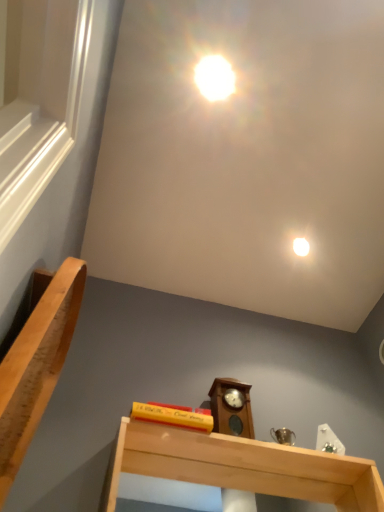
Find the location of a particular element. This screenshot has height=512, width=384. free space in front of white glossy droplight at upper center is located at coordinates tap(317, 213).